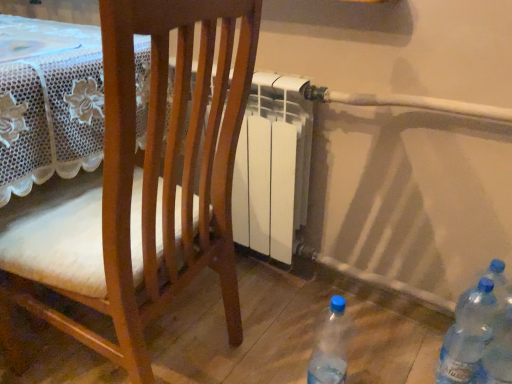
Question: Is the depth of wooden chair at center greater than that of transparent plastic bottles at lower right, placed as the second bottle when sorted from left to right?

Choices:
 (A) yes
 (B) no

Answer: (B)

Question: From a real-world perspective, is wooden chair at center positioned over transparent plastic bottles at lower right, placed as the second bottle when sorted from left to right, based on gravity?

Choices:
 (A) yes
 (B) no

Answer: (A)

Question: Does wooden chair at center have a greater height compared to transparent plastic bottles at lower right, placed as the 2th bottle when sorted from right to left?

Choices:
 (A) no
 (B) yes

Answer: (B)

Question: Considering the relative sizes of wooden chair at center and transparent plastic bottles at lower right, placed as the second bottle when sorted from left to right, in the image provided, is wooden chair at center bigger than transparent plastic bottles at lower right, placed as the second bottle when sorted from left to right,?

Choices:
 (A) no
 (B) yes

Answer: (B)

Question: Is wooden chair at center thinner than transparent plastic bottles at lower right, placed as the 2th bottle when sorted from right to left?

Choices:
 (A) yes
 (B) no

Answer: (B)

Question: From the image's perspective, is transparent plastic bottle at lower right, which appears as the 3th bottle when viewed from the right, positioned above or below wooden chair at center?

Choices:
 (A) below
 (B) above

Answer: (A)

Question: Considering the positions of transparent plastic bottle at lower right, which appears as the 3th bottle when viewed from the right, and wooden chair at center in the image, is transparent plastic bottle at lower right, which appears as the 3th bottle when viewed from the right, bigger or smaller than wooden chair at center?

Choices:
 (A) big
 (B) small

Answer: (B)

Question: Is point (322, 374) positioned closer to the camera than point (177, 9)?

Choices:
 (A) farther
 (B) closer

Answer: (A)

Question: Visually, is transparent plastic bottle at lower right, which appears as the 3th bottle when viewed from the right, positioned to the left or to the right of wooden chair at center?

Choices:
 (A) right
 (B) left

Answer: (A)

Question: Visually, is transparent plastic bottles at lower right, placed as the second bottle when sorted from left to right, positioned to the left or to the right of transparent plastic bottle at lower right, which appears as the 3th bottle when viewed from the right?

Choices:
 (A) right
 (B) left

Answer: (A)

Question: Is transparent plastic bottles at lower right, placed as the 2th bottle when sorted from right to left, bigger or smaller than transparent plastic bottle at lower right, marked as the first bottle in a left-to-right arrangement?

Choices:
 (A) big
 (B) small

Answer: (B)

Question: From the image's perspective, is transparent plastic bottles at lower right, placed as the 2th bottle when sorted from right to left, positioned above or below transparent plastic bottle at lower right, which appears as the 3th bottle when viewed from the right?

Choices:
 (A) above
 (B) below

Answer: (A)

Question: From a real-world perspective, relative to transparent plastic bottle at lower right, marked as the first bottle in a left-to-right arrangement, is transparent plastic bottles at lower right, placed as the 2th bottle when sorted from right to left, vertically above or below?

Choices:
 (A) below
 (B) above

Answer: (B)

Question: Looking at their shapes, would you say blue translucent bottle at lower right, acting as the third bottle starting from the left, is wider or thinner than wooden chair at center?

Choices:
 (A) thin
 (B) wide

Answer: (A)

Question: In the image, is blue translucent bottle at lower right, acting as the third bottle starting from the left, on the left side or the right side of wooden chair at center?

Choices:
 (A) right
 (B) left

Answer: (A)